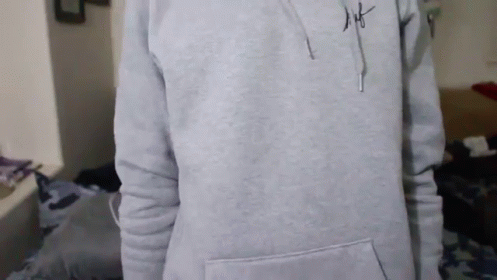
At what (x,y) coordinates should I click in order to perform the action: click on rectangular window above bed. Please return your answer as a coordinate pair (x, y). Image resolution: width=497 pixels, height=280 pixels. Looking at the image, I should click on (236, 31).